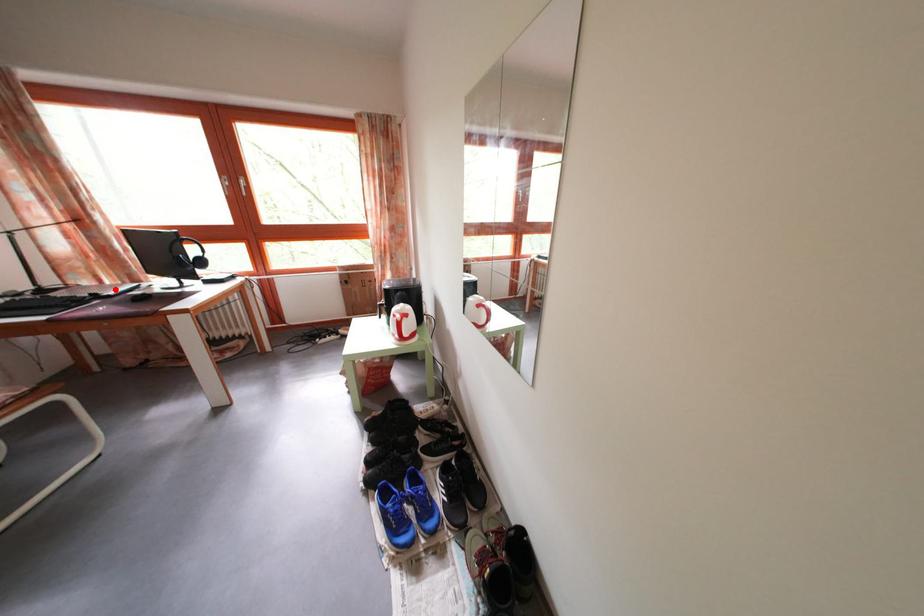
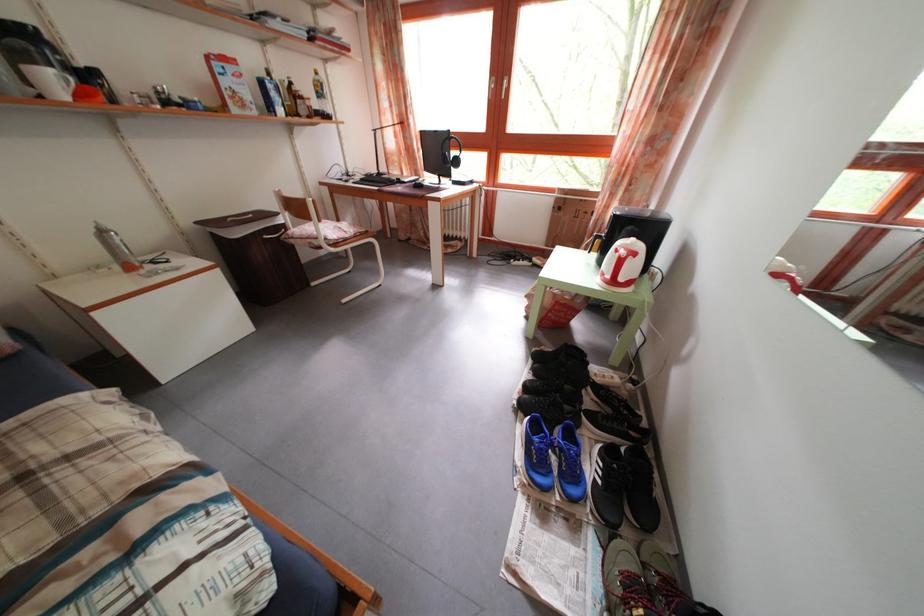
Question: A red point is marked in image1. In image2, is the corresponding 3D point closer to the camera or farther? Reply with the corresponding letter.

Choices:
 (A) The corresponding 3D point is closer.
 (B) The corresponding 3D point is farther.

Answer: (A)